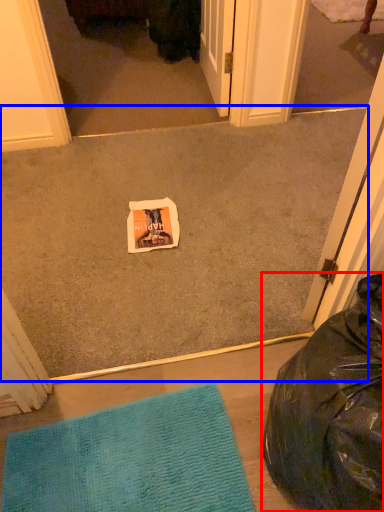
Question: Which object appears closest to the camera in this image, bean bag chair (highlighted by a red box) or concrete (highlighted by a blue box)?

Choices:
 (A) bean bag chair
 (B) concrete

Answer: (A)